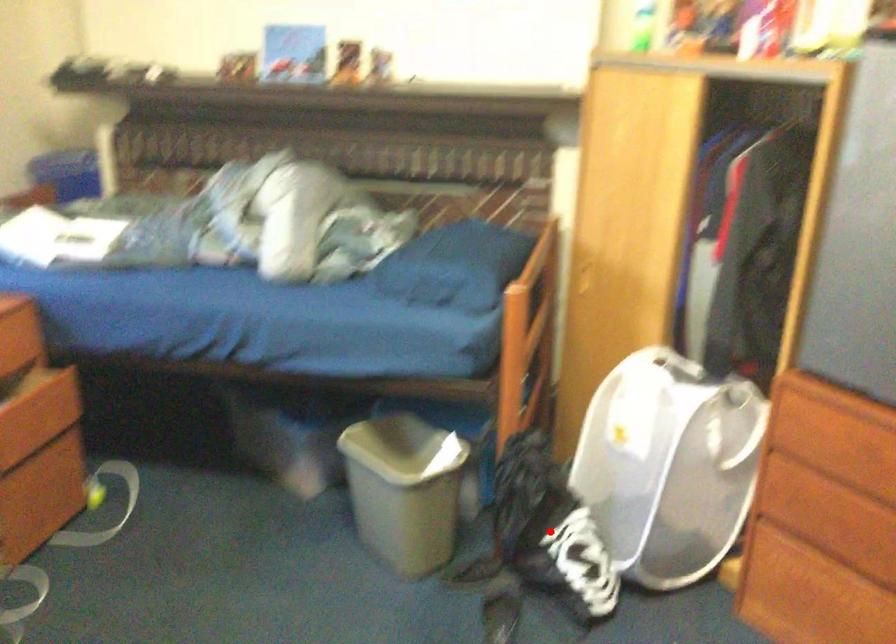
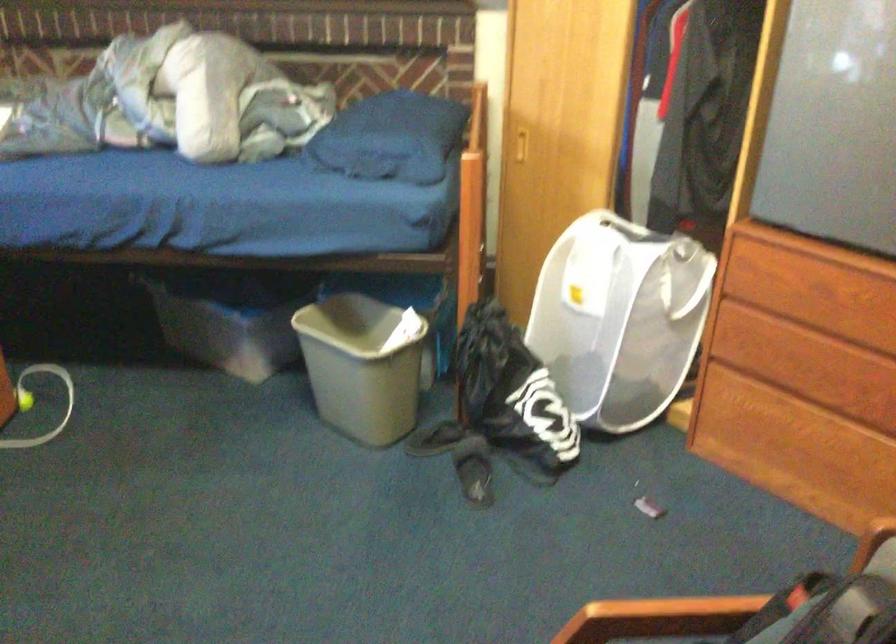
In the second image, find the point that corresponds to the highlighted location in the first image.

(513, 395)